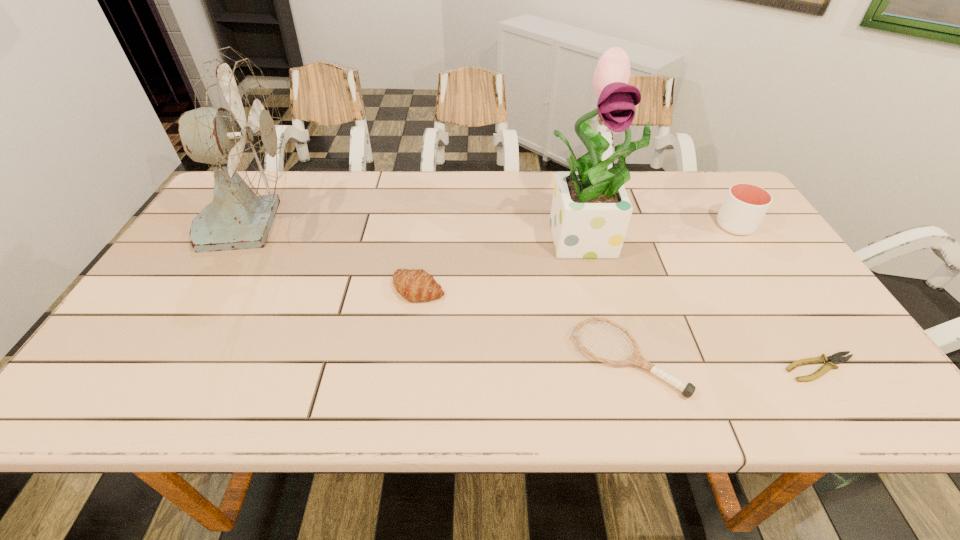
This screenshot has height=540, width=960. I want to click on the leftmost object, so [x=236, y=128].

The width and height of the screenshot is (960, 540). In order to click on flower arrangement in this screenshot , I will do `click(590, 213)`.

The width and height of the screenshot is (960, 540). Find the location of `the fourth shortest object`. the fourth shortest object is located at coordinates (745, 205).

Where is `crescent roll`? This screenshot has width=960, height=540. crescent roll is located at coordinates (416, 285).

The height and width of the screenshot is (540, 960). I want to click on the third nearest object, so click(416, 285).

At what (x,y) coordinates should I click in order to perform the action: click on tennis racket. Please return your answer as a coordinate pair (x, y). The height and width of the screenshot is (540, 960). Looking at the image, I should click on (635, 358).

Identify the location of pliers. (x=836, y=358).

Locate an element on the screen. This screenshot has width=960, height=540. vacant space located 0.360m in front of the fan to blow air is located at coordinates (425, 222).

Locate an element on the screen. This screenshot has height=540, width=960. vacant space located on the front-facing side of the flower arrangement is located at coordinates (610, 314).

At what (x,y) coordinates should I click in order to perform the action: click on free location located 0.230m on the front of the fourth shortest object. Please return your answer as a coordinate pair (x, y). Looking at the image, I should click on (782, 298).